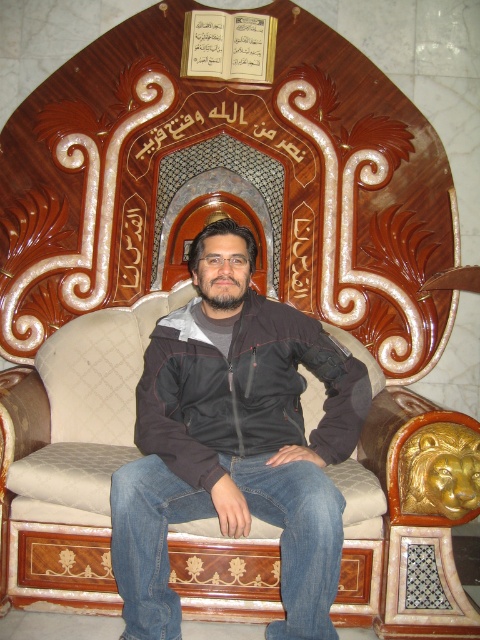
Is black matte jacket at center taller than black softshell jacket at center?

Yes, black matte jacket at center is taller than black softshell jacket at center.

Is point (228, 326) closer to camera compared to point (190, 406)?

No, it is not.

Image resolution: width=480 pixels, height=640 pixels. What are the coordinates of `black matte jacket at center` in the screenshot? It's located at (236, 442).

Is black softshell jacket at center to the left of wooden carved book at upper center from the viewer's perspective?

Incorrect, black softshell jacket at center is not on the left side of wooden carved book at upper center.

Is point (180, 330) behind point (212, 36)?

That is False.

The width and height of the screenshot is (480, 640). What do you see at coordinates (243, 390) in the screenshot?
I see `black softshell jacket at center` at bounding box center [243, 390].

Find the location of a particular element. This screenshot has height=640, width=480. black softshell jacket at center is located at coordinates (243, 390).

Between point (264, 337) and point (244, 54), which one is positioned behind?

Point (244, 54)

This screenshot has width=480, height=640. What do you see at coordinates (236, 442) in the screenshot?
I see `black matte jacket at center` at bounding box center [236, 442].

I want to click on black matte jacket at center, so click(x=236, y=442).